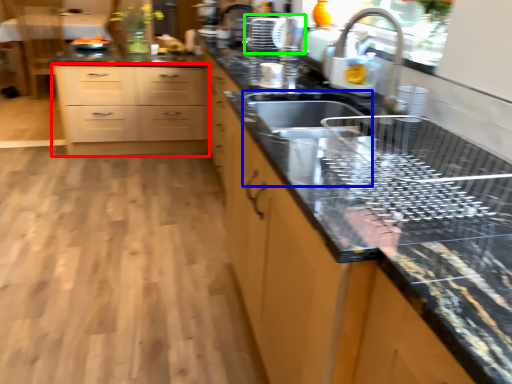
Question: Which is nearer to the chest of drawers (highlighted by a red box)? sink (highlighted by a blue box) or appliance (highlighted by a green box).

Choices:
 (A) sink
 (B) appliance

Answer: (B)